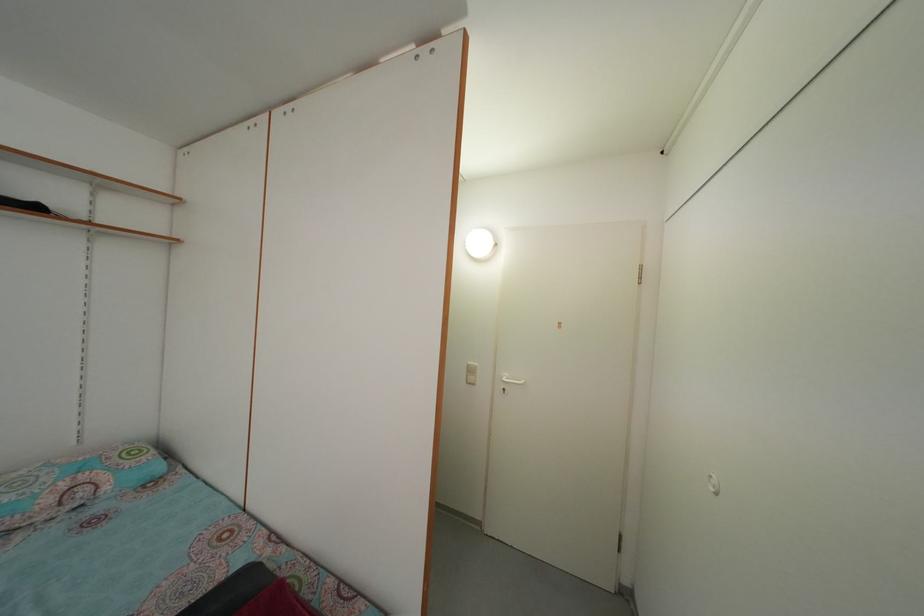
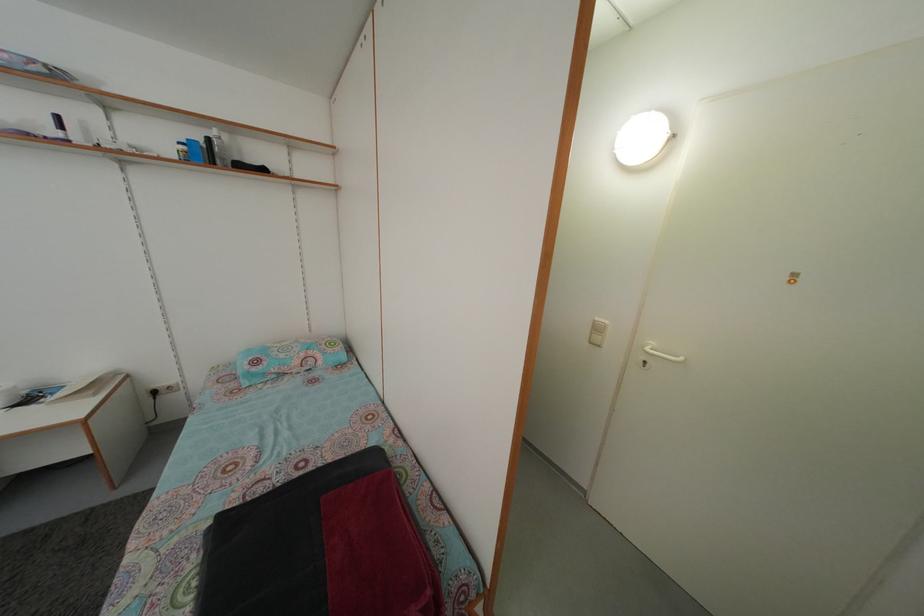
The point at (509, 387) is marked in the first image. Where is the corresponding point in the second image?

(652, 355)